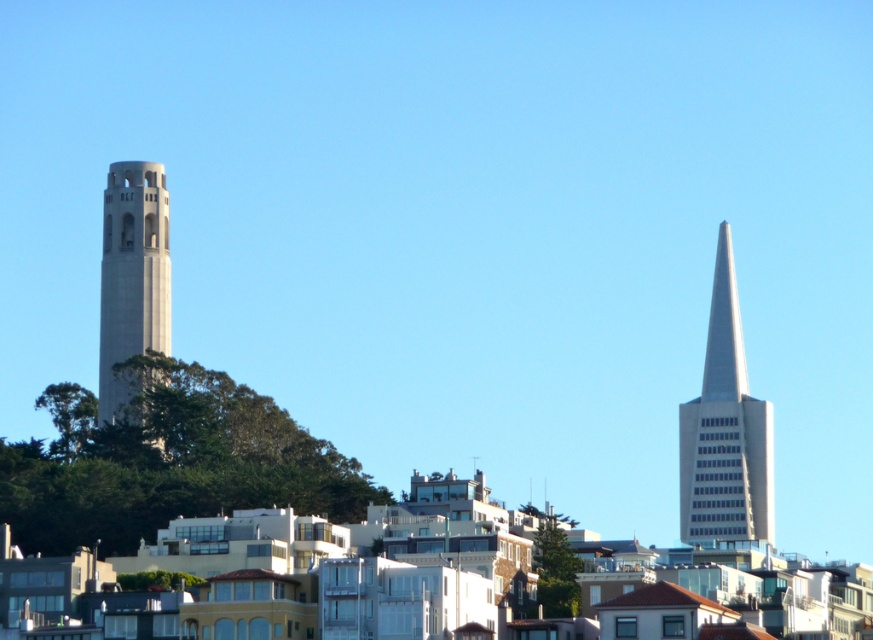
Question: Does silver metallic spire at right have a smaller size compared to white concrete tower at left?

Choices:
 (A) no
 (B) yes

Answer: (B)

Question: Which point is farther to the camera?

Choices:
 (A) white concrete tower at left
 (B) silver metallic spire at right

Answer: (B)

Question: Which object is farther from the camera taking this photo?

Choices:
 (A) white concrete tower at left
 (B) silver metallic spire at right

Answer: (B)

Question: Can you confirm if silver metallic spire at right is smaller than white concrete tower at left?

Choices:
 (A) no
 (B) yes

Answer: (B)

Question: Does silver metallic spire at right have a larger size compared to white concrete tower at left?

Choices:
 (A) no
 (B) yes

Answer: (A)

Question: Among these points, which one is farthest from the camera?

Choices:
 (A) (746, 467)
 (B) (113, 241)

Answer: (A)